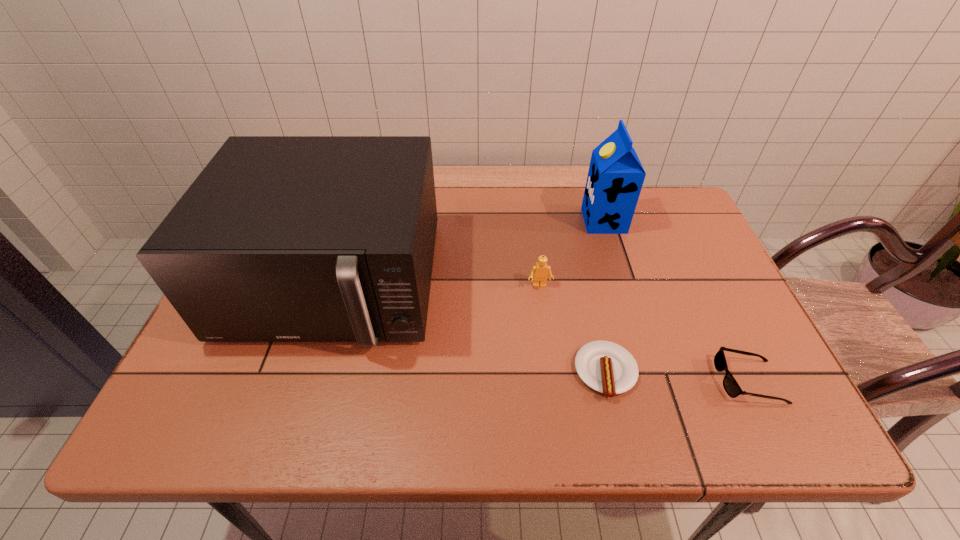
I want to click on carton, so click(x=615, y=178).

At what (x,y) coordinates should I click in order to perform the action: click on microwave oven. Please return your answer as a coordinate pair (x, y). Image resolution: width=960 pixels, height=540 pixels. Looking at the image, I should click on (280, 238).

I want to click on the third tallest object, so click(539, 273).

The image size is (960, 540). Identify the location of Lego. (539, 273).

The width and height of the screenshot is (960, 540). I want to click on sunglasses, so click(x=732, y=388).

This screenshot has height=540, width=960. I want to click on the second shortest object, so click(732, 388).

Find the location of `sausage`. sausage is located at coordinates (606, 367).

Where is `vacant area situated with the cap open on the carton`? The image size is (960, 540). vacant area situated with the cap open on the carton is located at coordinates (466, 221).

Locate an element on the screen. vacant point located 0.130m with the cap open on the carton is located at coordinates (540, 221).

The height and width of the screenshot is (540, 960). Find the location of `free region located with the cap open on the carton`. free region located with the cap open on the carton is located at coordinates (537, 221).